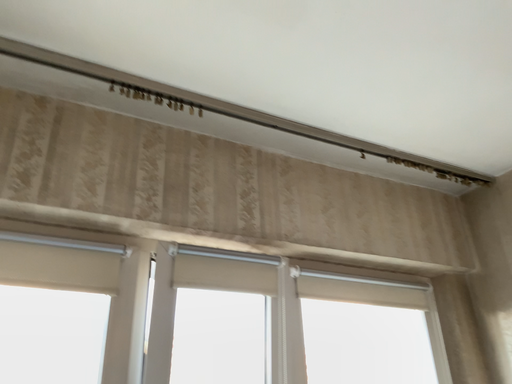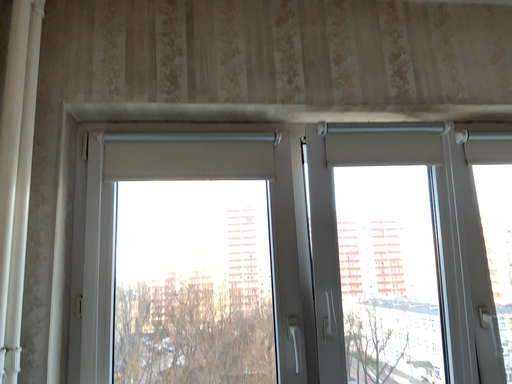
Question: How did the camera likely rotate when shooting the video?

Choices:
 (A) rotated upward
 (B) rotated downward

Answer: (B)